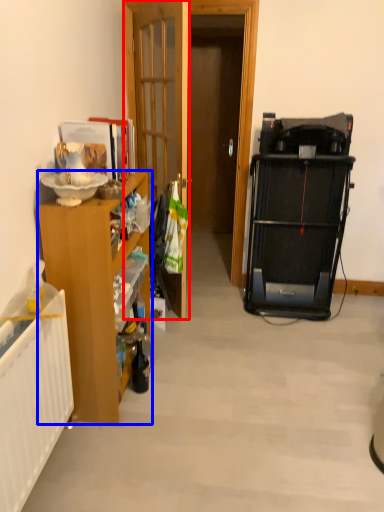
Question: Which object appears closest to the camera in this image, door (highlighted by a red box) or cabinetry (highlighted by a blue box)?

Choices:
 (A) door
 (B) cabinetry

Answer: (B)